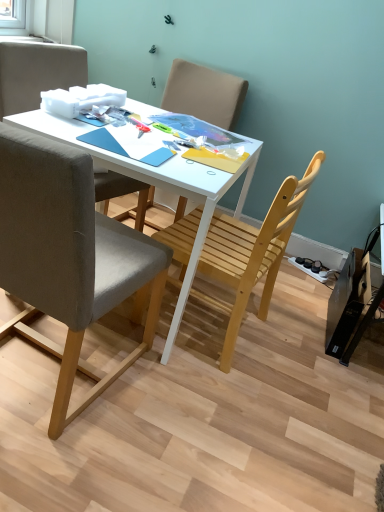
Locate an element on the screen. This screenshot has width=384, height=512. vacant region above white matte desk at center (from a real-world perspective) is located at coordinates (163, 136).